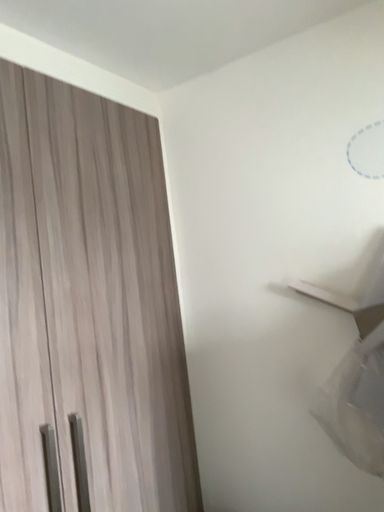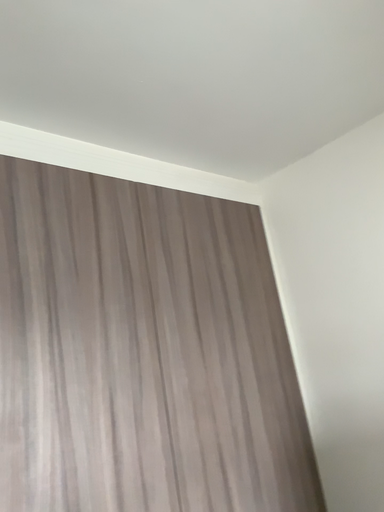
Question: Which way did the camera rotate in the video?

Choices:
 (A) rotated right
 (B) rotated left

Answer: (B)